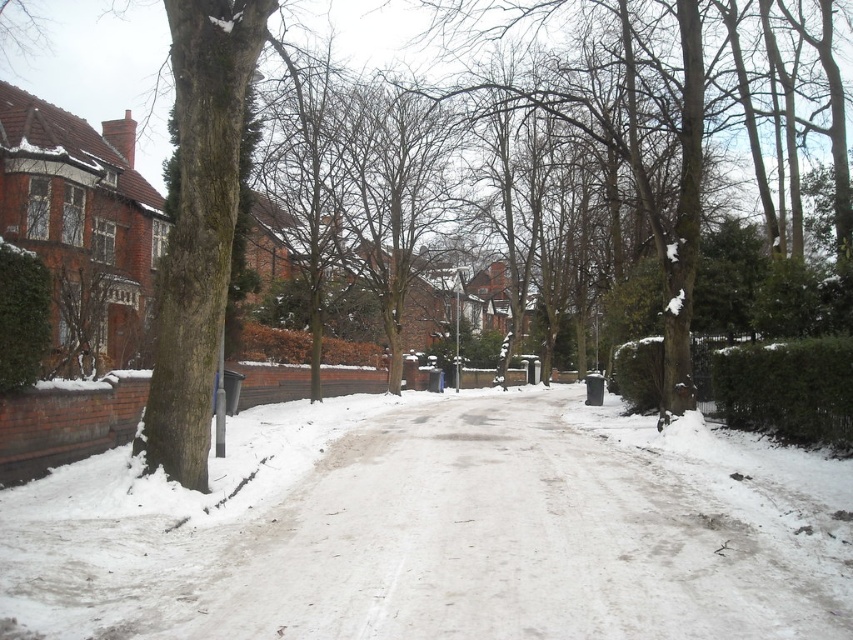
Question: In this image, where is white powdery snow at center located relative to green mossy bark tree at left?

Choices:
 (A) below
 (B) above

Answer: (A)

Question: Observing the image, what is the correct spatial positioning of white powdery snow at center in reference to green mossy bark tree at left?

Choices:
 (A) above
 (B) below

Answer: (B)

Question: Which of the following is the closest to the observer?

Choices:
 (A) (248, 4)
 (B) (164, 584)

Answer: (B)

Question: Can you confirm if white powdery snow at center is positioned to the left of green mossy bark tree at left?

Choices:
 (A) no
 (B) yes

Answer: (A)